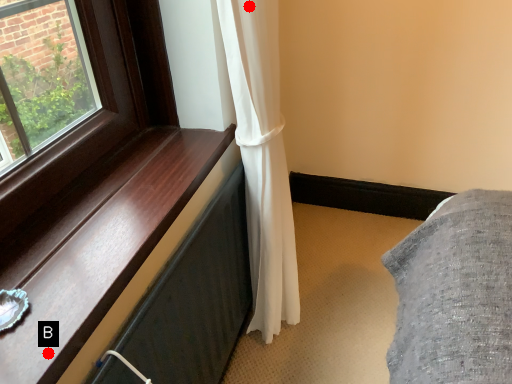
Question: Two points are circled on the image, labeled by A and B beside each circle. Which of the following is the farthest from the observer?

Choices:
 (A) A is further
 (B) B is further

Answer: (A)